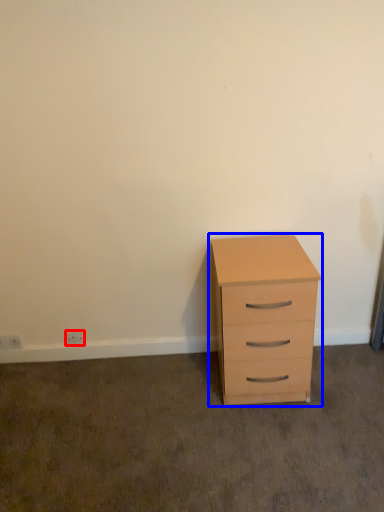
Question: Which object appears farthest to the camera in this image, electric outlet (highlighted by a red box) or chest of drawers (highlighted by a blue box)?

Choices:
 (A) electric outlet
 (B) chest of drawers

Answer: (A)